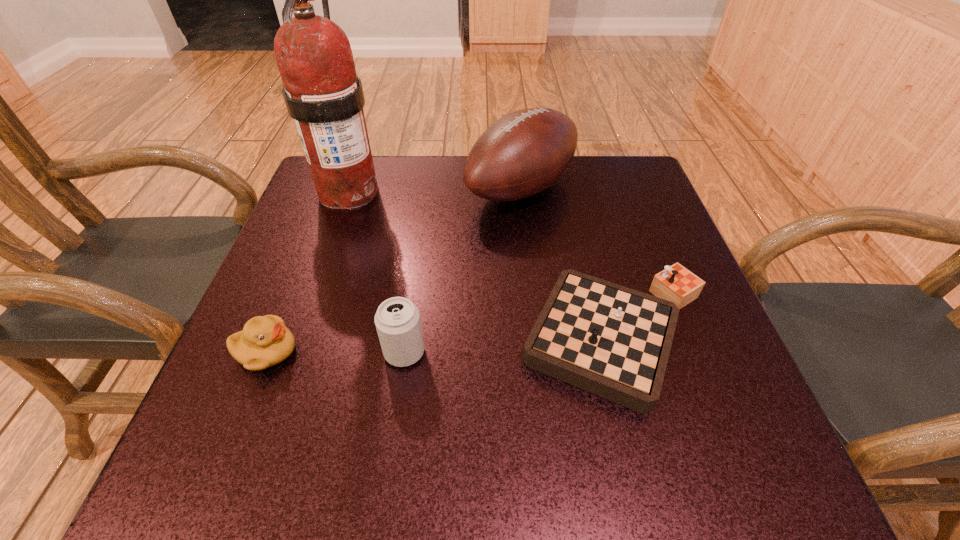
At what (x,y) coordinates should I click in order to perform the action: click on free space located 0.390m on the left of the chessboard. Please return your answer as a coordinate pair (x, y). The height and width of the screenshot is (540, 960). Looking at the image, I should click on (301, 337).

You are a GUI agent. You are given a task and a screenshot of the screen. Output one action in this format:
    pyautogui.click(x=<x>, y=<y>)
    Task: Click on the fire extinguisher located in the far edge section of the desktop
    The image size is (960, 540).
    Given the screenshot: What is the action you would take?
    pyautogui.click(x=322, y=93)

You are a GUI agent. You are given a task and a screenshot of the screen. Output one action in this format:
    pyautogui.click(x=<x>, y=<y>)
    Task: Click on the football (American) at the far edge
    This screenshot has height=540, width=960.
    Given the screenshot: What is the action you would take?
    pyautogui.click(x=524, y=152)

This screenshot has width=960, height=540. What are the coordinates of `fire extinguisher present at the left edge` in the screenshot? It's located at (322, 93).

Locate an element on the screen. Image resolution: width=960 pixels, height=540 pixels. duckling positioned at the left edge is located at coordinates (265, 341).

Find the location of `object located at the right edge`. object located at the right edge is located at coordinates (613, 341).

Where is `object present at the far left corner`? object present at the far left corner is located at coordinates (322, 93).

Locate an element on the screen. free space at the far edge of the desktop is located at coordinates (416, 165).

Locate an element on the screen. This screenshot has width=960, height=540. vacant point at the near edge is located at coordinates (559, 452).

Where is `vacant point at the left edge`? The width and height of the screenshot is (960, 540). vacant point at the left edge is located at coordinates (327, 302).